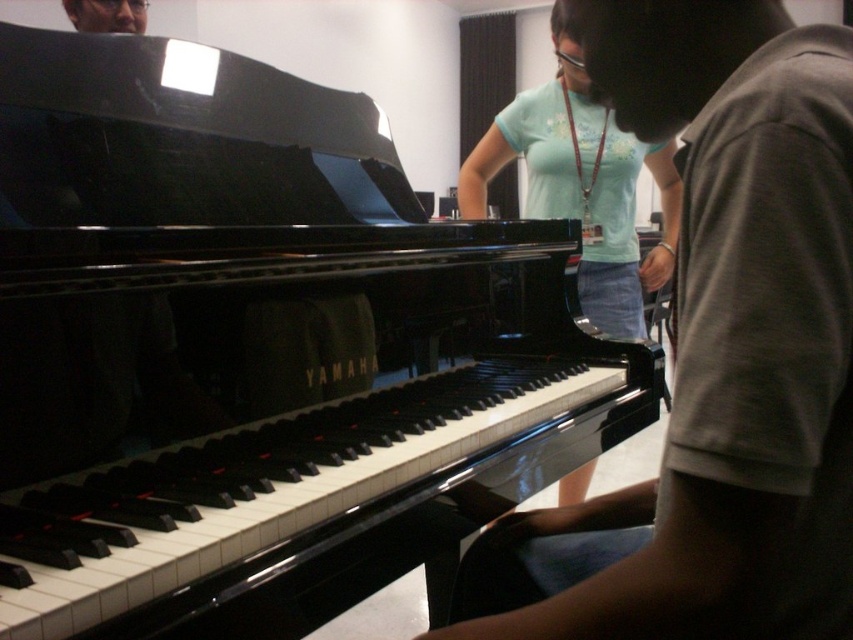
Question: Observing the image, what is the correct spatial positioning of matte black piano at left in reference to light blue t-shirt at center?

Choices:
 (A) below
 (B) above

Answer: (A)

Question: Which point is farther from the camera taking this photo?

Choices:
 (A) (581, 264)
 (B) (850, 212)

Answer: (A)

Question: In this image, where is matte black piano at left located relative to light blue t-shirt at center?

Choices:
 (A) above
 (B) below

Answer: (B)

Question: Does matte black piano at left have a lesser width compared to light blue t-shirt at center?

Choices:
 (A) yes
 (B) no

Answer: (A)